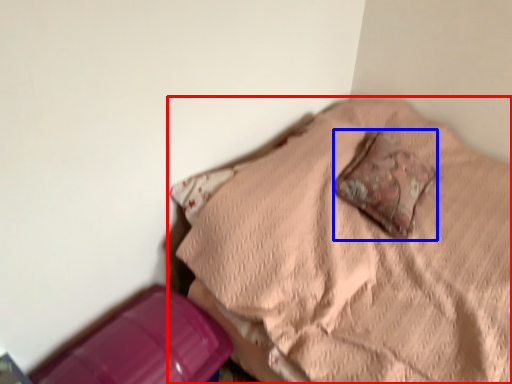
Question: Which object is closer to the camera taking this photo, furniture (highlighted by a red box) or pillow (highlighted by a blue box)?

Choices:
 (A) furniture
 (B) pillow

Answer: (A)